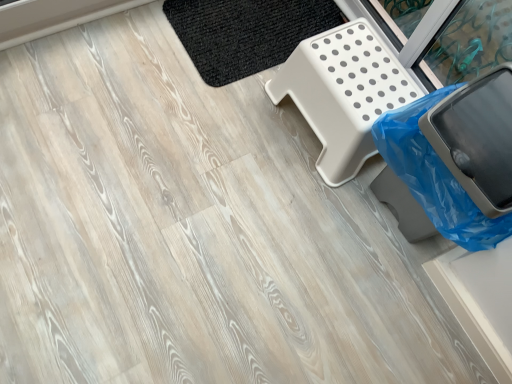
Image resolution: width=512 pixels, height=384 pixels. Identify the location of free location in front of white plastic step stool at upper right. (285, 203).